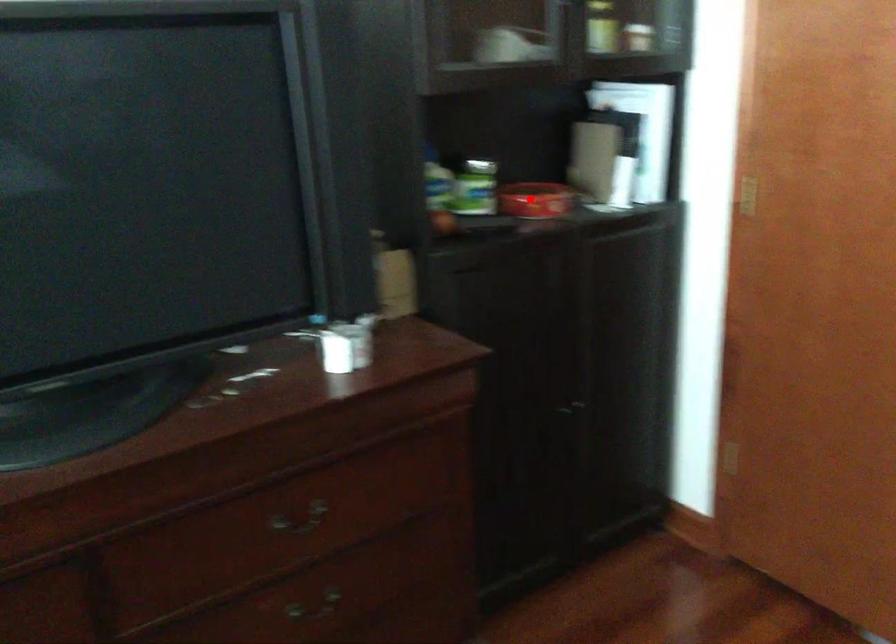
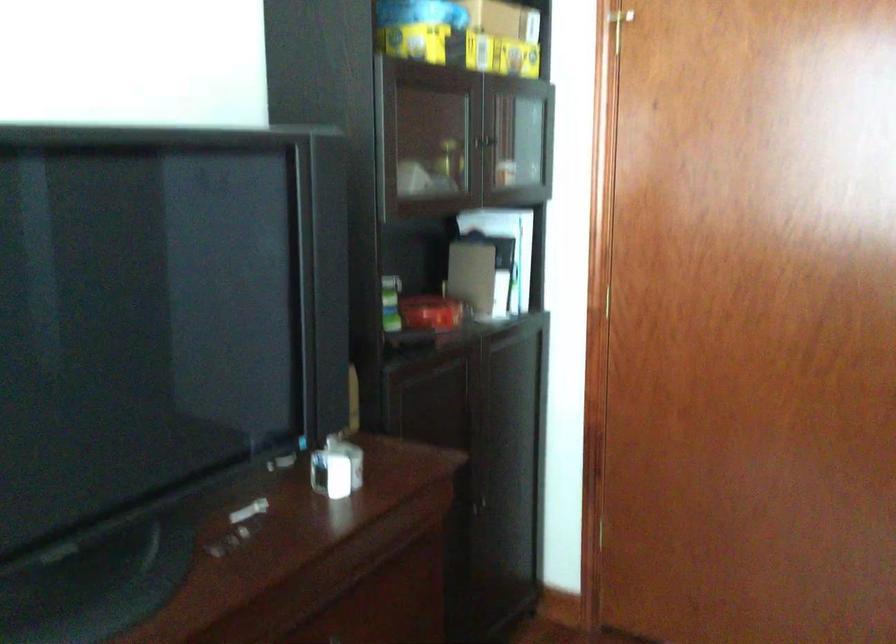
Locate, in the second image, the point that corresponds to the highlighted location in the first image.

(431, 313)